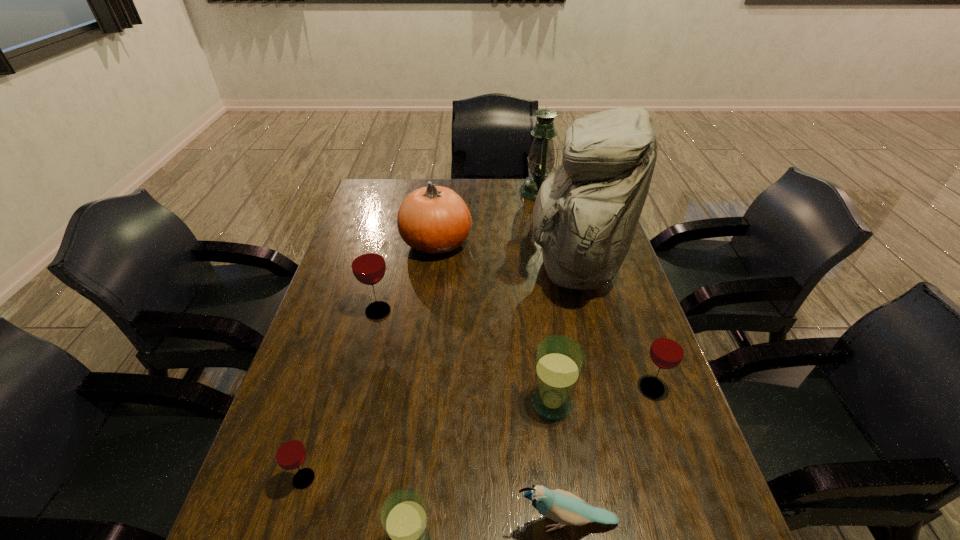
You are a GUI agent. You are given a task and a screenshot of the screen. Output one action in this format:
    pyautogui.click(x=<x>, y=<y>)
    Task: Click on the blank space located on the back of the fourth glass from left to right
    
    Given the screenshot: What is the action you would take?
    pyautogui.click(x=543, y=343)

I want to click on vacant space situated 0.090m at the face of the bird, so click(468, 522).

Where is `free space located at the face of the bird`? free space located at the face of the bird is located at coordinates (361, 522).

The image size is (960, 540). What are the coordinates of `vacant space located 0.100m at the face of the bird` in the screenshot? It's located at (462, 522).

The width and height of the screenshot is (960, 540). Find the location of `free space located 0.260m on the back of the seventh farthest object`. free space located 0.260m on the back of the seventh farthest object is located at coordinates (338, 364).

I want to click on object that is positioned at the far edge, so click(x=541, y=158).

At what (x,y) coordinates should I click in order to perform the action: click on backpack that is at the right edge. Please return your answer as a coordinate pair (x, y). The height and width of the screenshot is (540, 960). Looking at the image, I should click on (586, 212).

In order to click on oil lamp present at the right edge in this screenshot , I will do `click(541, 158)`.

What are the coordinates of `glass located in the right edge section of the desktop` in the screenshot? It's located at (667, 350).

Locate an element on the screen. The width and height of the screenshot is (960, 540). object that is at the far right corner is located at coordinates (541, 158).